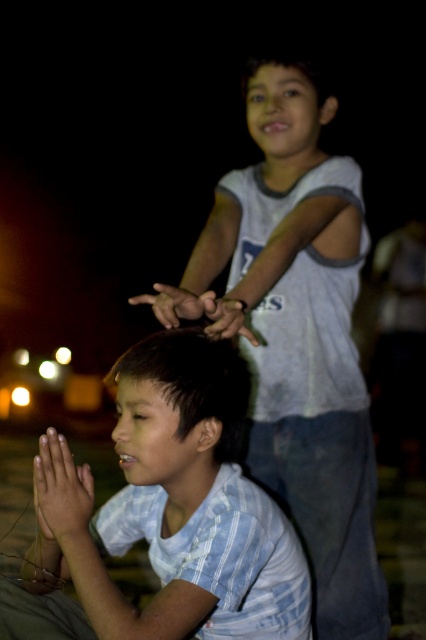
Based on the scene described, which object is wider, the dark brown hair at center or the smooth skin hand at center?

The dark brown hair at center is wider than the smooth skin hand at center according to the description.

You are a photographer trying to capture the scene with a camera. You notice the light blue striped shirt at lower left and the smooth skin hands at center. Which object should you focus on first if you want to ensure both are in focus, considering their heights?

The light blue striped shirt at lower left has a greater height compared to smooth skin hands at center, so you should focus on the taller object first to ensure both are in focus.

You are a photographer trying to capture the scene. You need to adjust your camera to focus on both the white cotton shirt at upper center and the matte skin hand at center. Which object should you focus on first to ensure proper alignment?

The white cotton shirt at upper center is to the right of the matte skin hand at center. Since the hand is closer to the center of the image, you should focus on the matte skin hand at center first to ensure proper alignment.